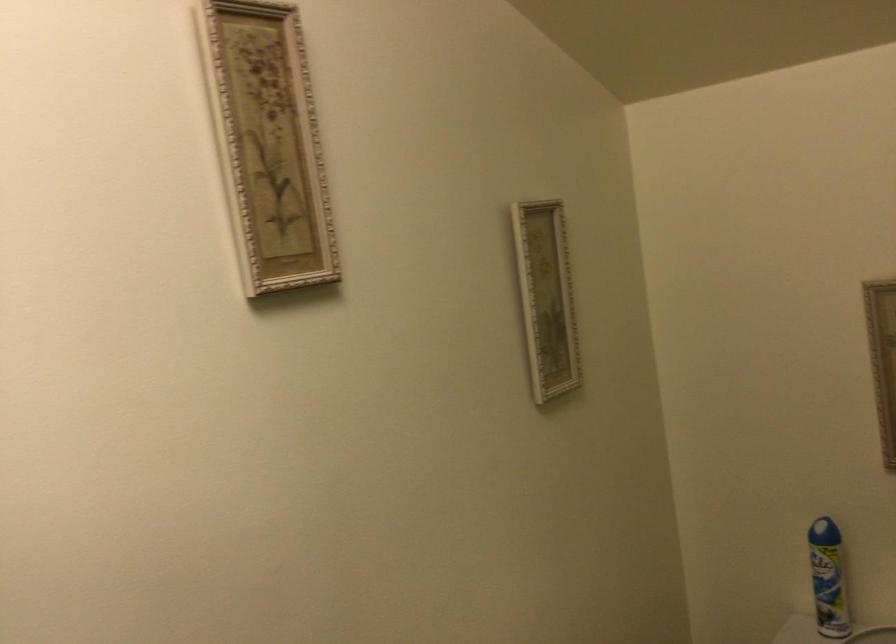
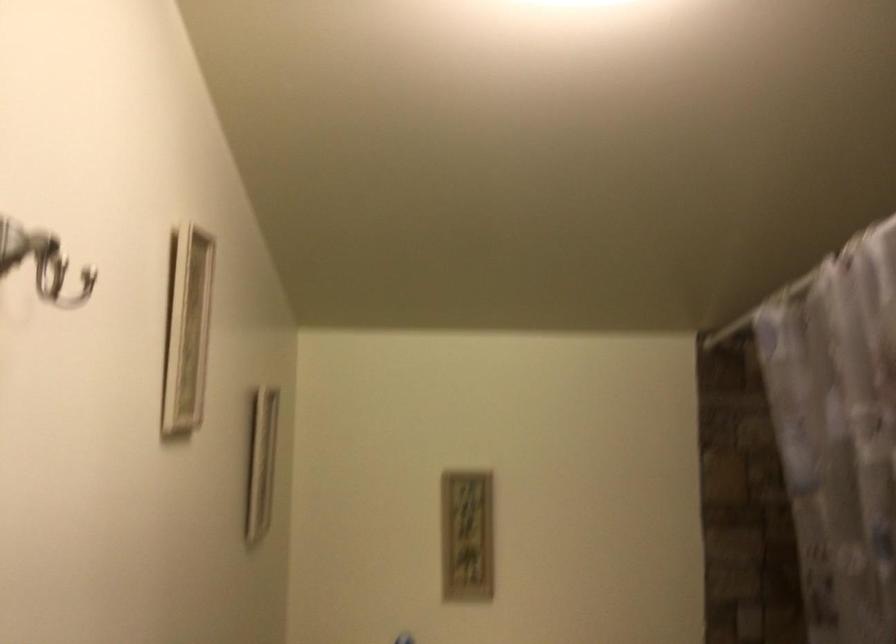
How did the camera likely rotate?

The camera's rotation is toward right-up.